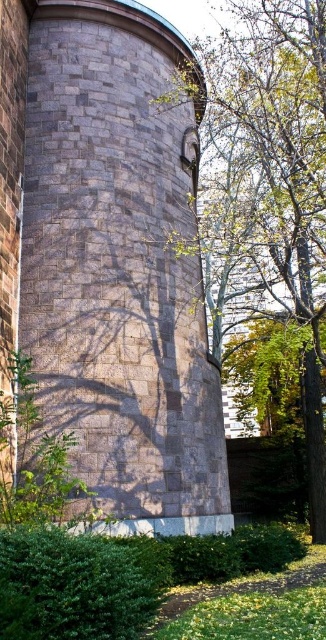
Question: Is gray stone tower at center thinner than green leafy tree at center?

Choices:
 (A) yes
 (B) no

Answer: (A)

Question: Is gray stone tower at center in front of green leafy tree at center?

Choices:
 (A) yes
 (B) no

Answer: (A)

Question: Does gray stone tower at center have a larger size compared to green leafy tree at center?

Choices:
 (A) yes
 (B) no

Answer: (B)

Question: Which object appears farthest from the camera in this image?

Choices:
 (A) gray stone tower at center
 (B) green leafy tree at center

Answer: (B)

Question: Which of the following is the closest to the observer?

Choices:
 (A) green leafy tree at center
 (B) gray stone tower at center

Answer: (B)